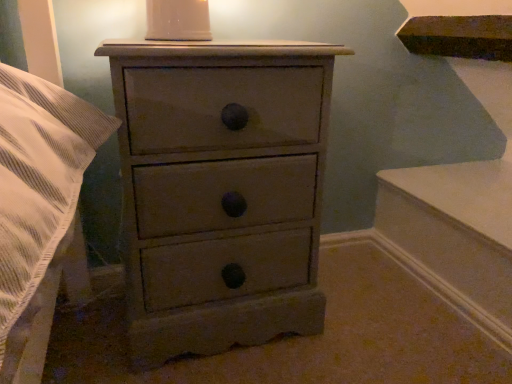
Question: Is white glossy candle holder at upper center oriented towards matte gray chest of drawers at center?

Choices:
 (A) no
 (B) yes

Answer: (A)

Question: Is white glossy candle holder at upper center behind matte gray chest of drawers at center?

Choices:
 (A) yes
 (B) no

Answer: (A)

Question: Is there a large distance between white glossy candle holder at upper center and matte gray chest of drawers at center?

Choices:
 (A) no
 (B) yes

Answer: (A)

Question: Is white glossy candle holder at upper center at the right side of matte gray chest of drawers at center?

Choices:
 (A) yes
 (B) no

Answer: (B)

Question: From the image's perspective, is white glossy candle holder at upper center above matte gray chest of drawers at center?

Choices:
 (A) no
 (B) yes

Answer: (B)

Question: From the image's perspective, does white glossy candle holder at upper center appear lower than matte gray chest of drawers at center?

Choices:
 (A) no
 (B) yes

Answer: (A)

Question: From the image's perspective, is matte gray chest of drawers at center below white glossy candle holder at upper center?

Choices:
 (A) yes
 (B) no

Answer: (A)

Question: Is matte gray chest of drawers at center not within white glossy candle holder at upper center?

Choices:
 (A) yes
 (B) no

Answer: (A)

Question: From the image's perspective, does matte gray chest of drawers at center appear higher than white glossy candle holder at upper center?

Choices:
 (A) yes
 (B) no

Answer: (B)

Question: Is matte gray chest of drawers at center to the right of white glossy candle holder at upper center from the viewer's perspective?

Choices:
 (A) yes
 (B) no

Answer: (A)

Question: Does matte gray chest of drawers at center have a larger size compared to white glossy candle holder at upper center?

Choices:
 (A) yes
 (B) no

Answer: (A)

Question: Is matte gray chest of drawers at center not near white glossy candle holder at upper center?

Choices:
 (A) no
 (B) yes

Answer: (A)

Question: Considering their positions, is white glossy candle holder at upper center located in front of or behind matte gray chest of drawers at center?

Choices:
 (A) front
 (B) behind

Answer: (B)